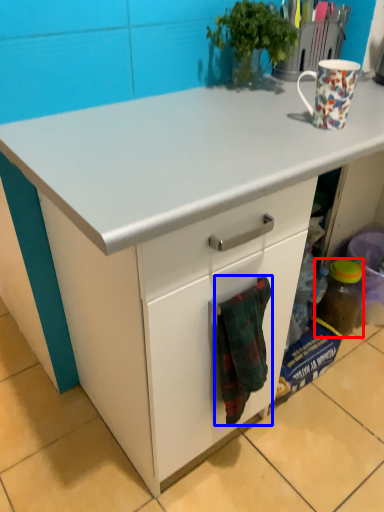
Question: Which of the following is the farthest to the observer, bottle (highlighted by a red box) or blanket (highlighted by a blue box)?

Choices:
 (A) bottle
 (B) blanket

Answer: (A)